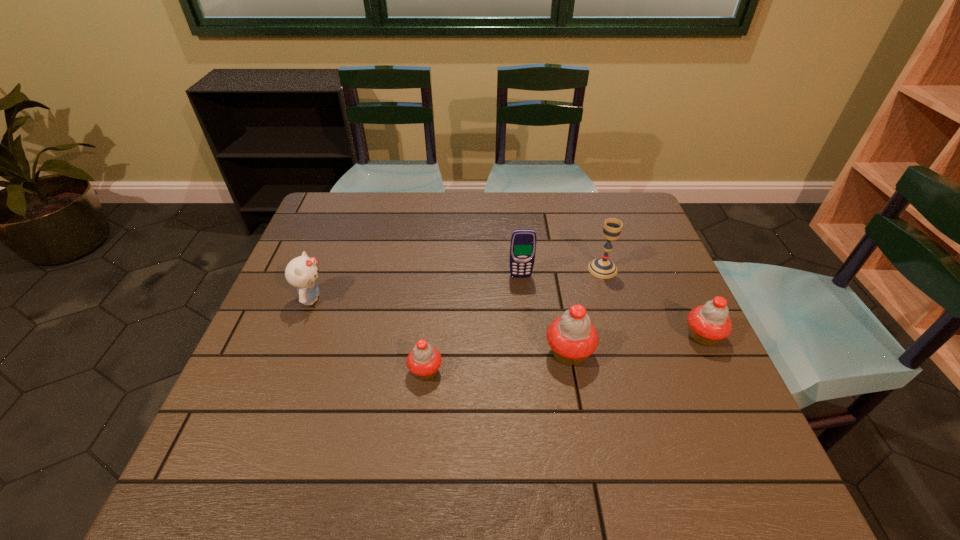
Find the location of `the second object from left to right`. the second object from left to right is located at coordinates (424, 360).

You are a GUI agent. You are given a task and a screenshot of the screen. Output one action in this format:
    pyautogui.click(x=<x>, y=<y>)
    Task: Click on the shortest object
    
    Given the screenshot: What is the action you would take?
    pyautogui.click(x=424, y=360)

This screenshot has height=540, width=960. I want to click on the second cupcake from right to left, so click(572, 337).

The width and height of the screenshot is (960, 540). What are the coordinates of `the third object from right to left` in the screenshot? It's located at 572,337.

You are a GUI agent. You are given a task and a screenshot of the screen. Output one action in this format:
    pyautogui.click(x=<x>, y=<y>)
    Task: Click on the second tallest cupcake
    The image size is (960, 540).
    Given the screenshot: What is the action you would take?
    pyautogui.click(x=707, y=324)

Locate an element on the screen. The width and height of the screenshot is (960, 540). the rightmost object is located at coordinates (707, 324).

You are a GUI agent. You are given a task and a screenshot of the screen. Output one action in this format:
    pyautogui.click(x=<x>, y=<y>)
    Task: Click on the fifth object from left to right
    The image size is (960, 540).
    Given the screenshot: What is the action you would take?
    pyautogui.click(x=604, y=268)

Locate an element on the screen. the leftmost object is located at coordinates [301, 272].

Locate an element on the screen. the fourth nearest object is located at coordinates (301, 272).

Locate an element on the screen. the fourth object from right to left is located at coordinates (523, 241).